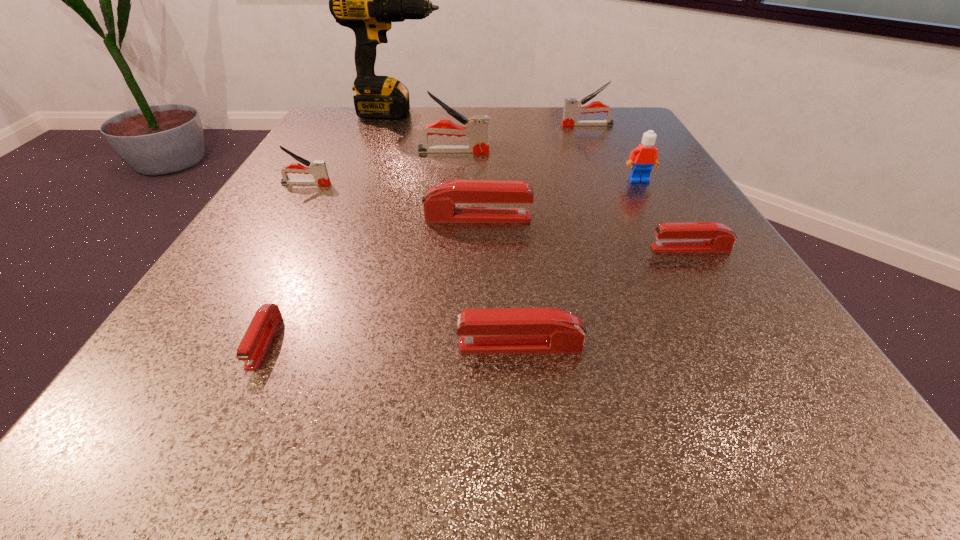
In the image, there is a desktop. Where is `vacant space at the right edge`? The height and width of the screenshot is (540, 960). vacant space at the right edge is located at coordinates (775, 309).

This screenshot has width=960, height=540. In the image, there is a desktop. What are the coordinates of `vacant space at the far left corner` in the screenshot? It's located at (361, 119).

Locate an element on the screen. The width and height of the screenshot is (960, 540). free spot at the near left corner of the desktop is located at coordinates (234, 448).

The image size is (960, 540). I want to click on vacant space at the far right corner of the desktop, so click(x=599, y=117).

This screenshot has height=540, width=960. What are the coordinates of `vacant space that is in between the seventh tallest object and the biggest gray stapler` in the screenshot? It's located at (487, 248).

Identify the location of free area in between the second biggest red stapler and the farthest red stapler. The width and height of the screenshot is (960, 540). (499, 282).

I want to click on vacant region between the third shortest object and the smallest gray stapler, so click(x=413, y=265).

Image resolution: width=960 pixels, height=540 pixels. I want to click on free space between the third shortest stapler and the leftmost gray stapler, so click(413, 265).

Where is `free spot between the farthest stapler and the third farthest stapler`? Image resolution: width=960 pixels, height=540 pixels. free spot between the farthest stapler and the third farthest stapler is located at coordinates (446, 154).

Locate an element on the screen. The image size is (960, 540). vacant point located between the rightmost gray stapler and the fifth tallest stapler is located at coordinates (554, 235).